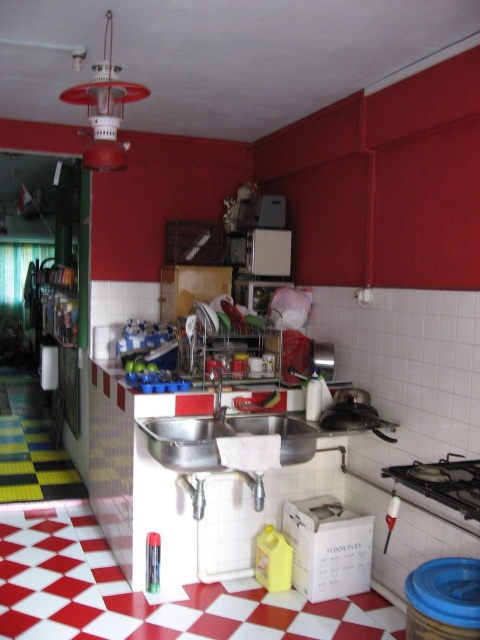
Question: Among these objects, which one is farthest from the camera?

Choices:
 (A) silver metallic sink at center
 (B) stainless steel sink at center
 (C) black matte stove at upper right

Answer: (B)

Question: Which point is farther to the camera?

Choices:
 (A) black matte stove at upper right
 (B) silver metallic sink at center

Answer: (B)

Question: Can you confirm if stainless steel sink at center is wider than black matte stove at upper right?

Choices:
 (A) no
 (B) yes

Answer: (B)

Question: Does black matte stove at upper right lie behind silver metallic sink at center?

Choices:
 (A) no
 (B) yes

Answer: (A)

Question: Based on their relative distances, which object is farther from the black matte stove at upper right?

Choices:
 (A) silver metallic sink at center
 (B) stainless steel sink at center

Answer: (A)

Question: Can you confirm if stainless steel sink at center is positioned to the left of silver metallic sink at center?

Choices:
 (A) yes
 (B) no

Answer: (B)